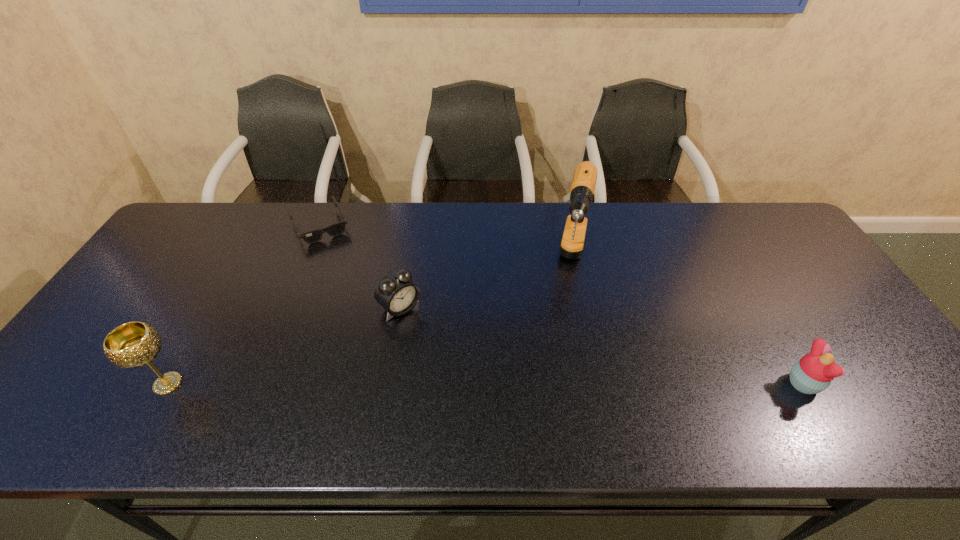
At what (x,y) coordinates should I click in order to perform the action: click on vacant space that satisfies the following two spatial constraints: 1. on the front side of the cupcake; 2. on the face of the leftmost object. Please return your answer as a coordinate pair (x, y). The height and width of the screenshot is (540, 960). Looking at the image, I should click on 167,384.

Identify the location of free region that satisfies the following two spatial constraints: 1. on the front side of the drill; 2. on the face of the cupcake. This screenshot has height=540, width=960. (599, 384).

The height and width of the screenshot is (540, 960). I want to click on vacant area that satisfies the following two spatial constraints: 1. on the front side of the alarm clock; 2. on the face of the rightmost object, so click(387, 384).

Where is `vacant space that satisfies the following two spatial constraints: 1. on the front side of the cupcake; 2. on the face of the fourth object from right to left`? Image resolution: width=960 pixels, height=540 pixels. vacant space that satisfies the following two spatial constraints: 1. on the front side of the cupcake; 2. on the face of the fourth object from right to left is located at coordinates (254, 384).